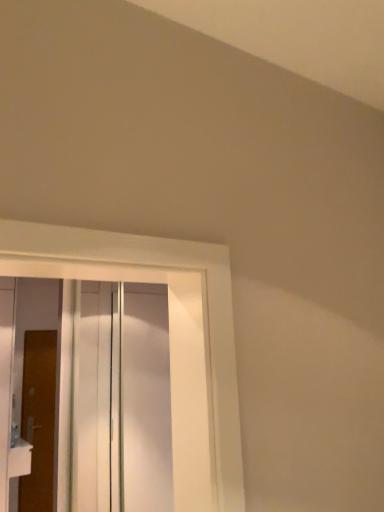
Question: Considering the positions of white glossy door at left, placed as the second door when sorted from back to front, and white plastic sink at lower left in the image, is white glossy door at left, placed as the second door when sorted from back to front, taller or shorter than white plastic sink at lower left?

Choices:
 (A) tall
 (B) short

Answer: (A)

Question: Is point (4, 342) positioned closer to the camera than point (8, 455)?

Choices:
 (A) closer
 (B) farther

Answer: (B)

Question: Based on their relative distances, which object is farther from the white glossy door at left, the 1th door when ordered from front to back?

Choices:
 (A) transparent glass door at center
 (B) brown wooden door at left, which appears as the first door when viewed from the back
 (C) white plastic sink at lower left

Answer: (A)

Question: Based on their relative distances, which object is nearer to the white plastic sink at lower left?

Choices:
 (A) brown wooden door at left, arranged as the second door when viewed from the front
 (B) white glossy door at left, the 1th door when ordered from front to back
 (C) transparent glass door at center

Answer: (B)